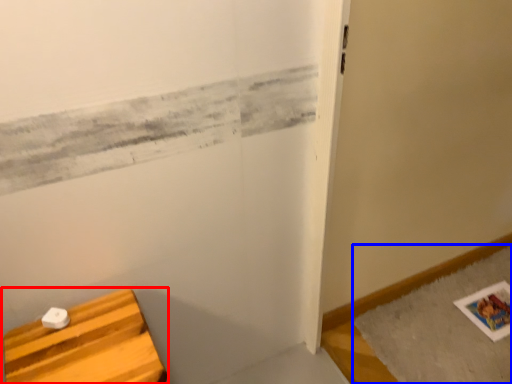
Question: Which point is further to the camera, furniture (highlighted by a red box) or bath mat (highlighted by a blue box)?

Choices:
 (A) furniture
 (B) bath mat

Answer: (B)